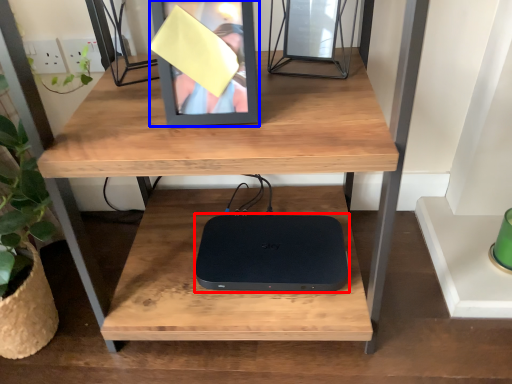
Question: Among these objects, which one is nearest to the camera, computer (highlighted by a red box) or picture frame (highlighted by a blue box)?

Choices:
 (A) computer
 (B) picture frame

Answer: (B)